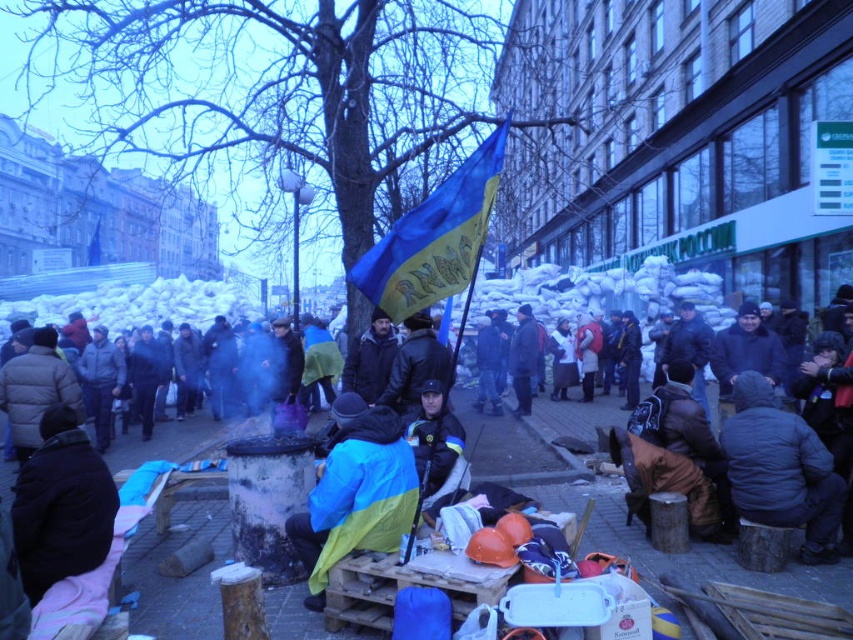
Is blue/yellow flag at center further to the viewer compared to blue/yellow fabric jacket at center?

No, it is in front of blue/yellow fabric jacket at center.

Can you confirm if blue/yellow flag at center is wider than blue/yellow fabric jacket at center?

Indeed, blue/yellow flag at center has a greater width compared to blue/yellow fabric jacket at center.

Does point (466, 413) lie behind point (329, 515)?

Yes, it is behind point (329, 515).

Image resolution: width=853 pixels, height=640 pixels. Identify the location of blue/yellow flag at center. (619, 509).

This screenshot has height=640, width=853. What do you see at coordinates (355, 492) in the screenshot?
I see `blue/yellow fabric jacket at center` at bounding box center [355, 492].

Who is positioned more to the left, blue/yellow fabric jacket at center or dark gray puffy jacket at lower right?

From the viewer's perspective, blue/yellow fabric jacket at center appears more on the left side.

Describe the element at coordinates (355, 492) in the screenshot. I see `blue/yellow fabric jacket at center` at that location.

Locate an element on the screen. The width and height of the screenshot is (853, 640). blue/yellow fabric jacket at center is located at coordinates (355, 492).

Between blue/yellow flag at center and blue/yellow fabric flag at center, which one appears on the right side from the viewer's perspective?

From the viewer's perspective, blue/yellow fabric flag at center appears more on the right side.

Does point (585, 429) come closer to viewer compared to point (451, 268)?

No.

You are a GUI agent. You are given a task and a screenshot of the screen. Output one action in this format:
    pyautogui.click(x=<x>, y=<y>)
    Task: Click on the blue/yellow flag at center
    This screenshot has width=853, height=640.
    Given the screenshot: What is the action you would take?
    pyautogui.click(x=619, y=509)